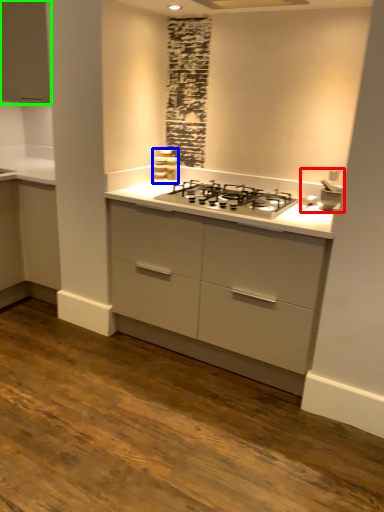
Question: Which object is the farthest from sink (highlighted by a red box)? Choose among these: appliance (highlighted by a blue box) or cabinetry (highlighted by a green box).

Choices:
 (A) appliance
 (B) cabinetry

Answer: (B)